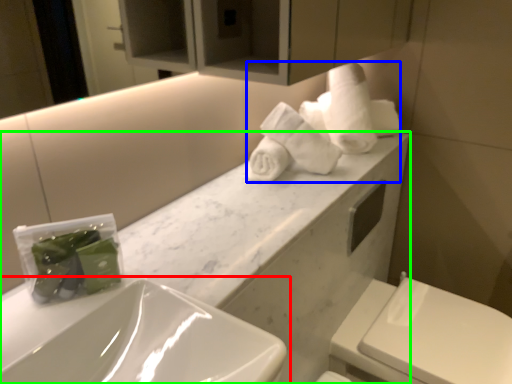
Question: Based on their relative distances, which object is nearer to sink (highlighted by a red box)? Choose from bath towel (highlighted by a blue box) and porcelain (highlighted by a green box).

Choices:
 (A) bath towel
 (B) porcelain

Answer: (B)